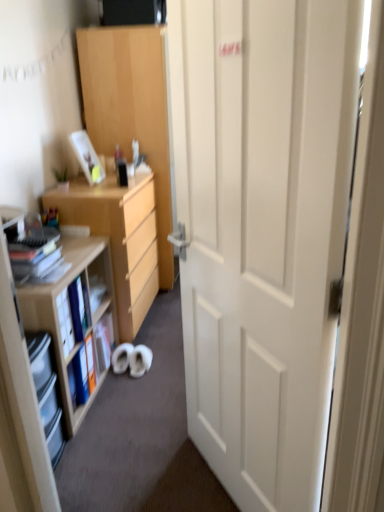
Locate an element on the screen. vacant region to the right of matte plastic picture frame at upper left is located at coordinates (109, 181).